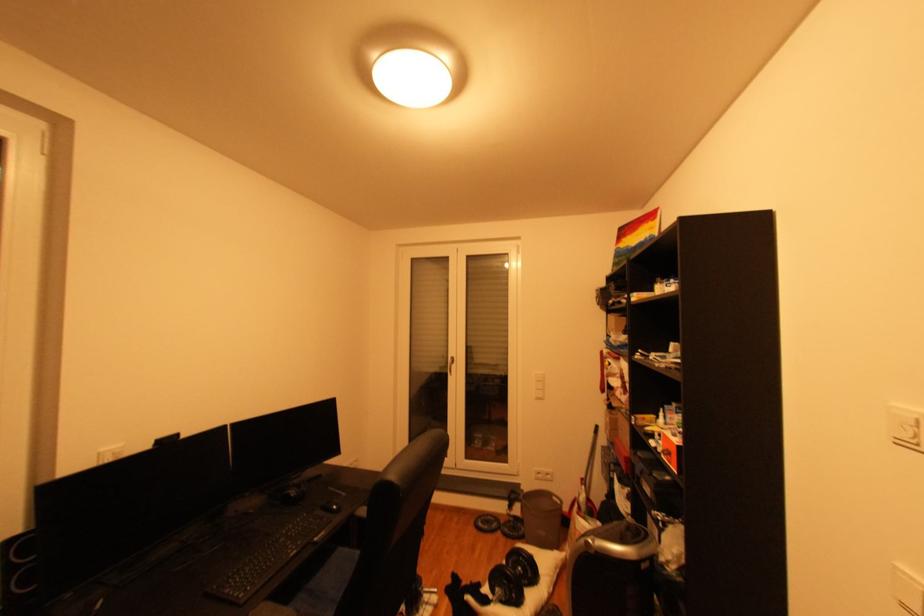
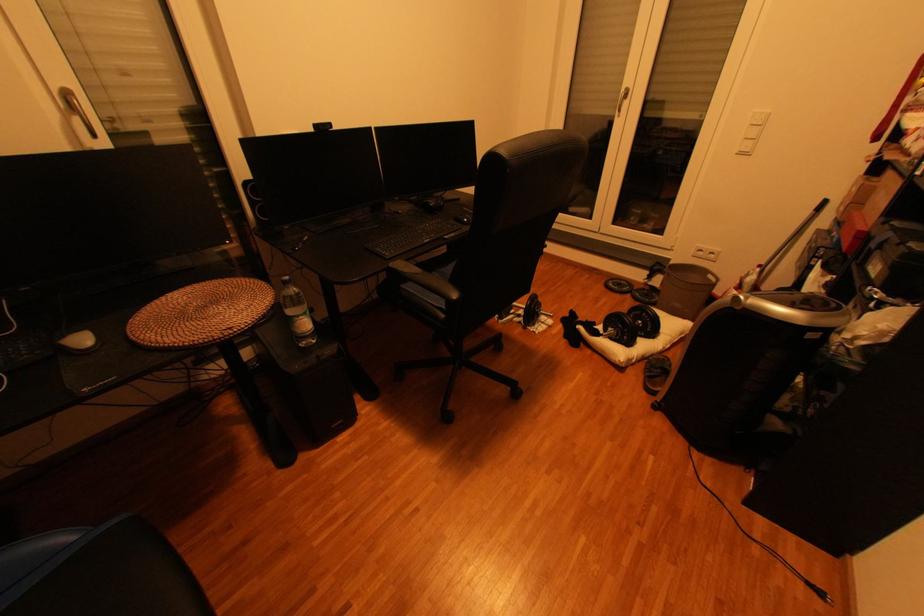
Locate, in the second image, the point that corresponds to [527,535] in the first image.

(658, 301)